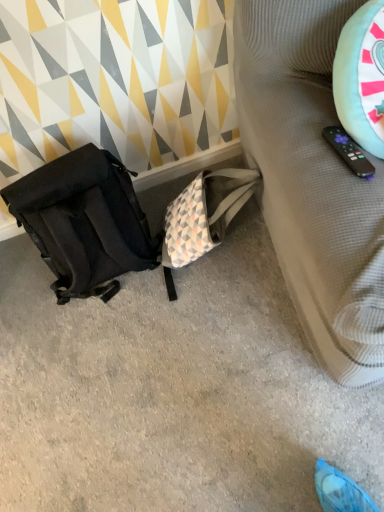
Question: Does black fabric backpack at left appear on the left side of matte black backpack at left?

Choices:
 (A) yes
 (B) no

Answer: (B)

Question: Is black fabric backpack at left smaller than matte black backpack at left?

Choices:
 (A) yes
 (B) no

Answer: (B)

Question: Is black fabric backpack at left turned away from matte black backpack at left?

Choices:
 (A) yes
 (B) no

Answer: (B)

Question: Can you confirm if black fabric backpack at left is bigger than matte black backpack at left?

Choices:
 (A) yes
 (B) no

Answer: (A)

Question: From a real-world perspective, does black fabric backpack at left sit lower than matte black backpack at left?

Choices:
 (A) yes
 (B) no

Answer: (A)

Question: From a real-world perspective, is textured beige sofa at right physically located above or below matte black backpack at left?

Choices:
 (A) above
 (B) below

Answer: (A)

Question: Based on their sizes in the image, would you say textured beige sofa at right is bigger or smaller than matte black backpack at left?

Choices:
 (A) big
 (B) small

Answer: (A)

Question: Do you think textured beige sofa at right is within matte black backpack at left, or outside of it?

Choices:
 (A) outside
 (B) inside

Answer: (A)

Question: Considering the positions of textured beige sofa at right and matte black backpack at left in the image, is textured beige sofa at right wider or thinner than matte black backpack at left?

Choices:
 (A) wide
 (B) thin

Answer: (A)

Question: Visually, is matte black backpack at left positioned to the left or to the right of black fabric backpack at left?

Choices:
 (A) right
 (B) left

Answer: (B)

Question: From their relative heights in the image, would you say matte black backpack at left is taller or shorter than black fabric backpack at left?

Choices:
 (A) tall
 (B) short

Answer: (A)

Question: From a real-world perspective, is matte black backpack at left positioned above or below black fabric backpack at left?

Choices:
 (A) below
 (B) above

Answer: (B)

Question: Is matte black backpack at left situated inside black fabric backpack at left or outside?

Choices:
 (A) outside
 (B) inside

Answer: (A)

Question: From the image's perspective, is black fabric backpack at left positioned above or below textured beige sofa at right?

Choices:
 (A) below
 (B) above

Answer: (A)

Question: Is black fabric backpack at left situated inside textured beige sofa at right or outside?

Choices:
 (A) outside
 (B) inside

Answer: (A)